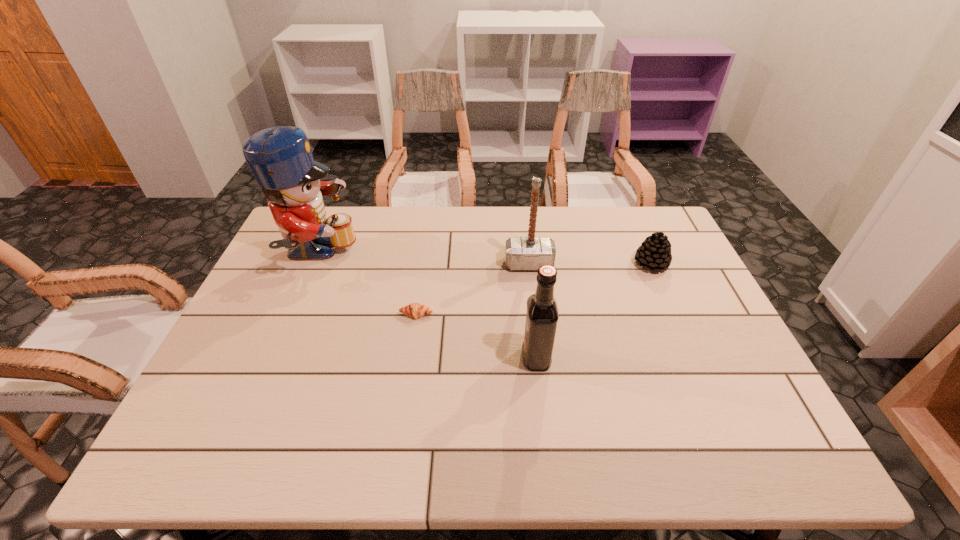
This screenshot has width=960, height=540. Identify the location of unoccupied position between the fourth farthest object and the hammer. (472, 289).

At what (x,y) coordinates should I click in order to perform the action: click on vacant area that lies between the hammer and the shortest object. Please return your answer as a coordinate pair (x, y). This screenshot has height=540, width=960. Looking at the image, I should click on [472, 289].

Identify the location of vacant area between the tallest object and the nearest object. (427, 306).

Identify the location of vacant space that's between the leftmost object and the nearest object. This screenshot has width=960, height=540. (427, 306).

Image resolution: width=960 pixels, height=540 pixels. In order to click on the closest object to the fourth object from right to left in this screenshot , I will do `click(280, 158)`.

Where is `object that stands as the closest to the nutcracker`? The height and width of the screenshot is (540, 960). object that stands as the closest to the nutcracker is located at coordinates (414, 310).

You are a GUI agent. You are given a task and a screenshot of the screen. Output one action in this format:
    pyautogui.click(x=<x>, y=<y>)
    Task: Click on the free location that satisfies the following two spatial constraints: 1. on the striking surface of the hammer; 2. on the front-facing side of the liquor
    This screenshot has width=960, height=540.
    Given the screenshot: What is the action you would take?
    pyautogui.click(x=540, y=358)

This screenshot has height=540, width=960. Identify the location of vacant area in the image that satisfies the following two spatial constraints: 1. at the narrow end of the pinecone; 2. on the front-facing side of the liquor. (693, 358).

At what (x,y) coordinates should I click in order to perform the action: click on free space that satisfies the following two spatial constraints: 1. at the narrow end of the rightmost object; 2. on the front-facing side of the nearest object. Please return your answer as a coordinate pair (x, y). Looking at the image, I should click on (693, 358).